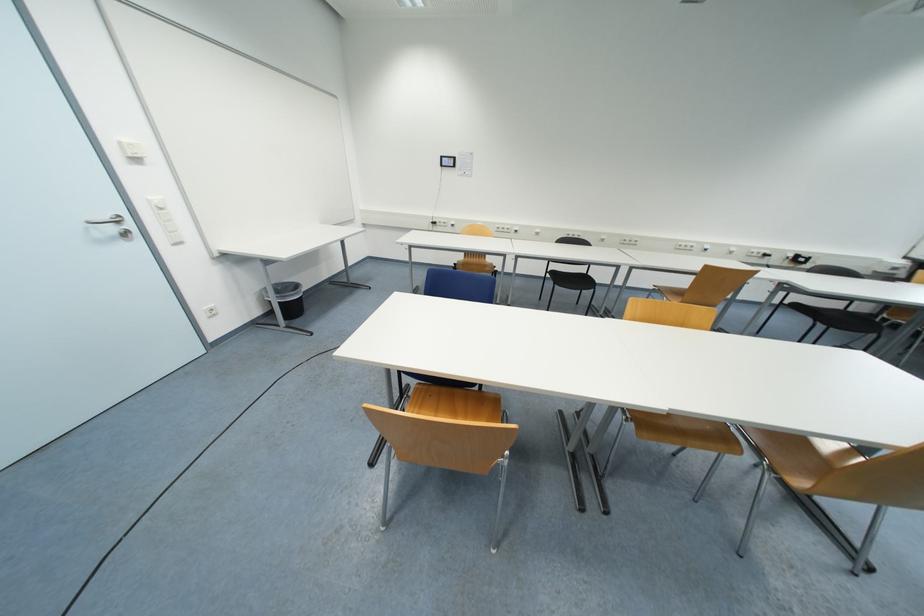
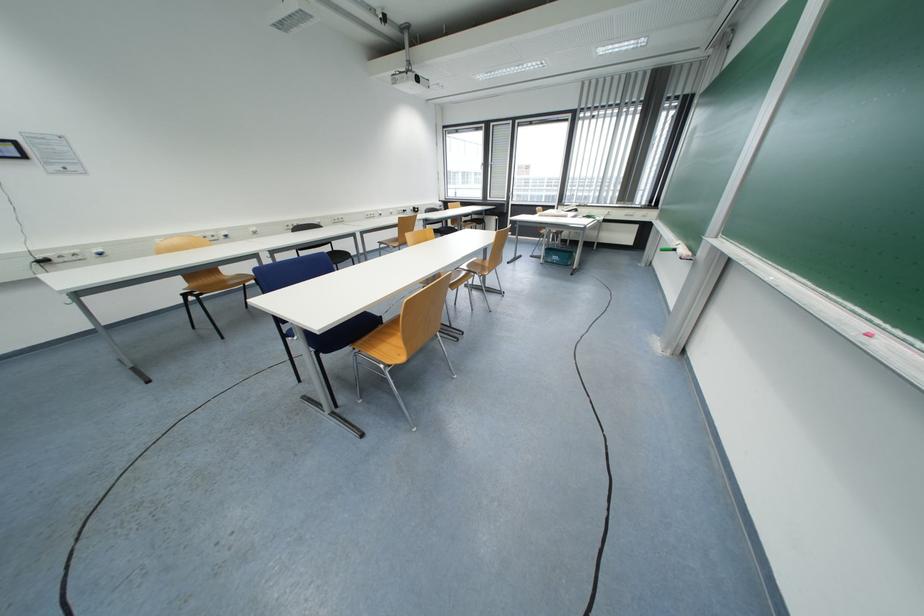
Locate, in the second image, the point that corresponds to (x=488, y=390) in the first image.

(390, 323)